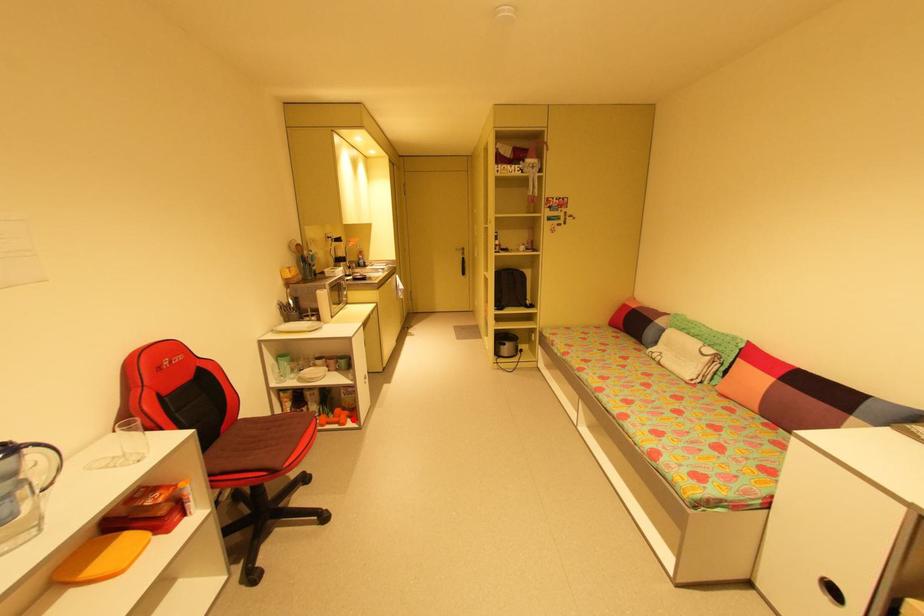
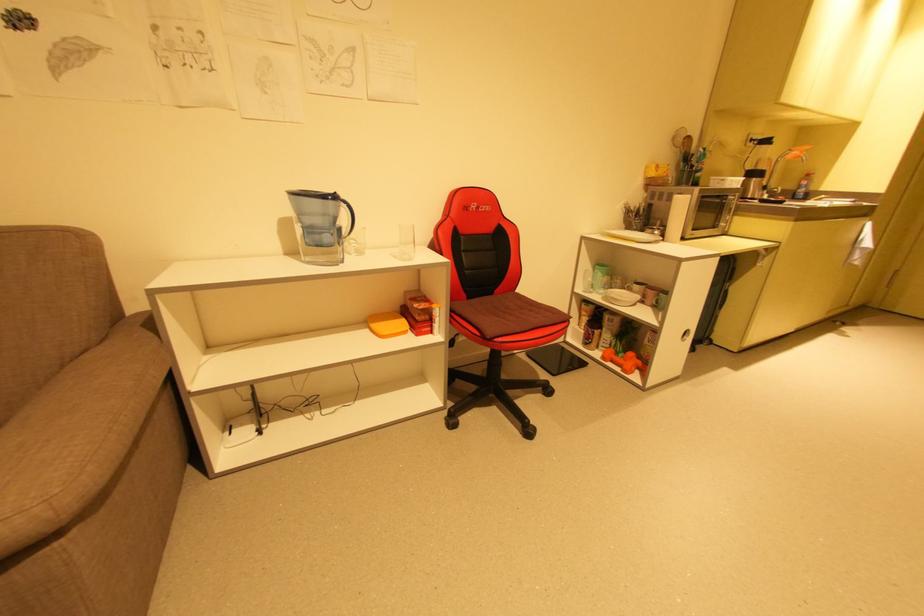
Locate, in the second image, the point that corresponds to the highlighted location in the first image.

(641, 371)